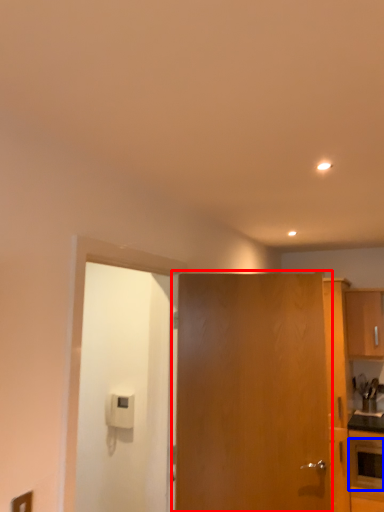
Question: Which object is closer to the camera taking this photo, door (highlighted by a red box) or appliance (highlighted by a blue box)?

Choices:
 (A) door
 (B) appliance

Answer: (A)